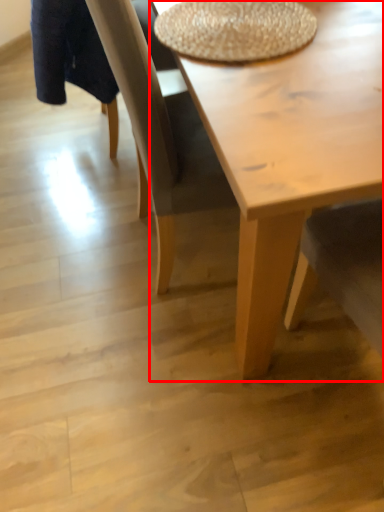
Question: In this image, where is coffee table (annotated by the red box) located relative to round table?

Choices:
 (A) right
 (B) left

Answer: (B)